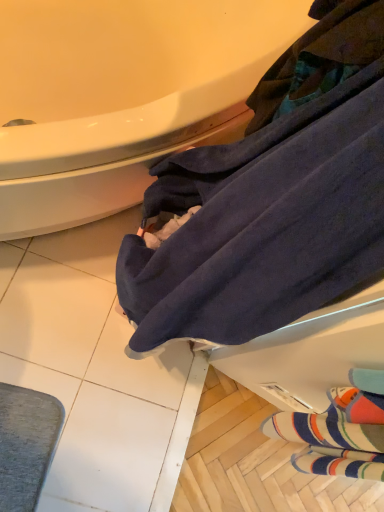
Question: From a real-world perspective, is striped wool socks at lower right above or below dark blue towel at lower right?

Choices:
 (A) above
 (B) below

Answer: (B)

Question: Is point (294, 503) closer or farther from the camera than point (365, 238)?

Choices:
 (A) closer
 (B) farther

Answer: (B)

Question: Estimate the real-world distances between objects in this image. Which object is farther from the dark blue towel at lower right?

Choices:
 (A) striped wool socks at lower right
 (B) white glossy bathtub at upper left

Answer: (A)

Question: Based on their relative distances, which object is nearer to the dark blue towel at lower right?

Choices:
 (A) white glossy bathtub at upper left
 (B) striped wool socks at lower right

Answer: (A)